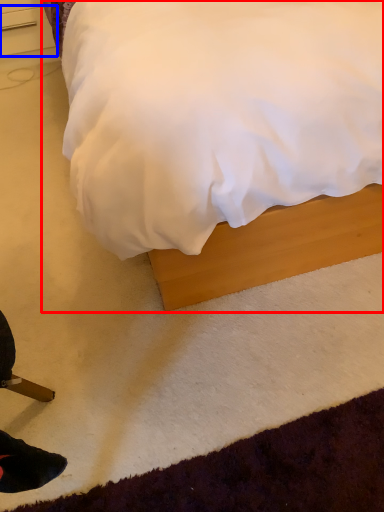
Question: Which object is further to the camera taking this photo, bed (highlighted by a red box) or drawer (highlighted by a blue box)?

Choices:
 (A) bed
 (B) drawer

Answer: (B)